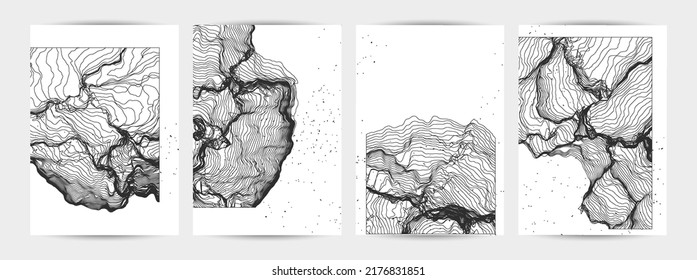
You are a GUI agent. You are given a task and a screenshot of the screen. Output one action in this format:
    pyautogui.click(x=<x>, y=<y>)
    Task: Click on the picture
    The width and height of the screenshot is (697, 280).
    Given the screenshot: What is the action you would take?
    pos(582,128), pos(429,126), pos(267,120), pos(100,116)